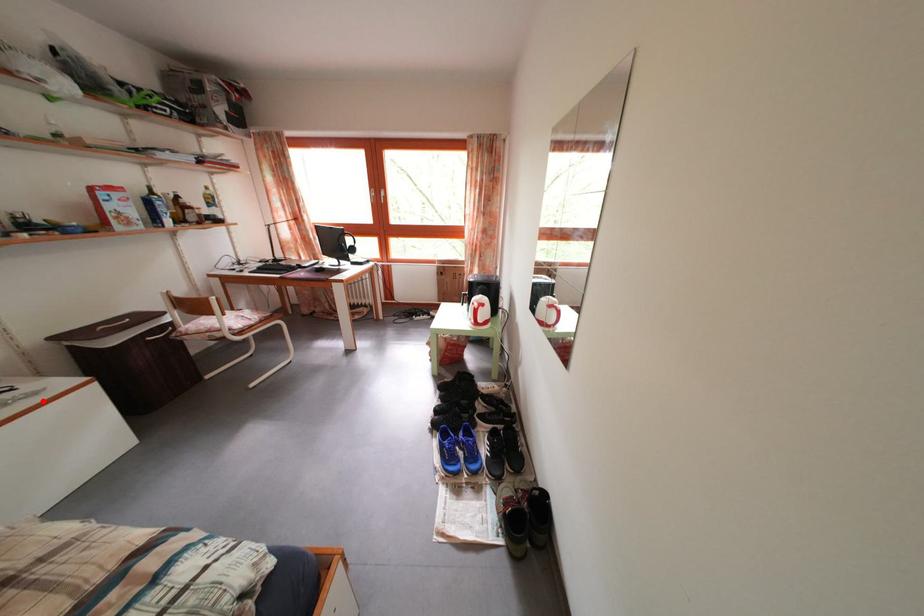
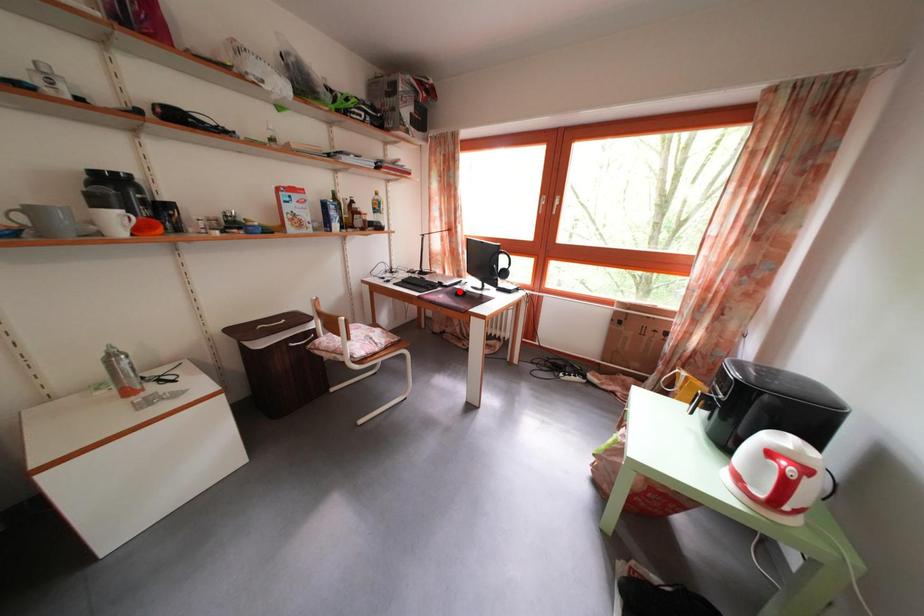
I am providing you with two images of the same scene from different viewpoints. A red point is marked on the first image and another point is marked on the second image. Does the point marked in image1 correspond to the same location as the one in image2?

No